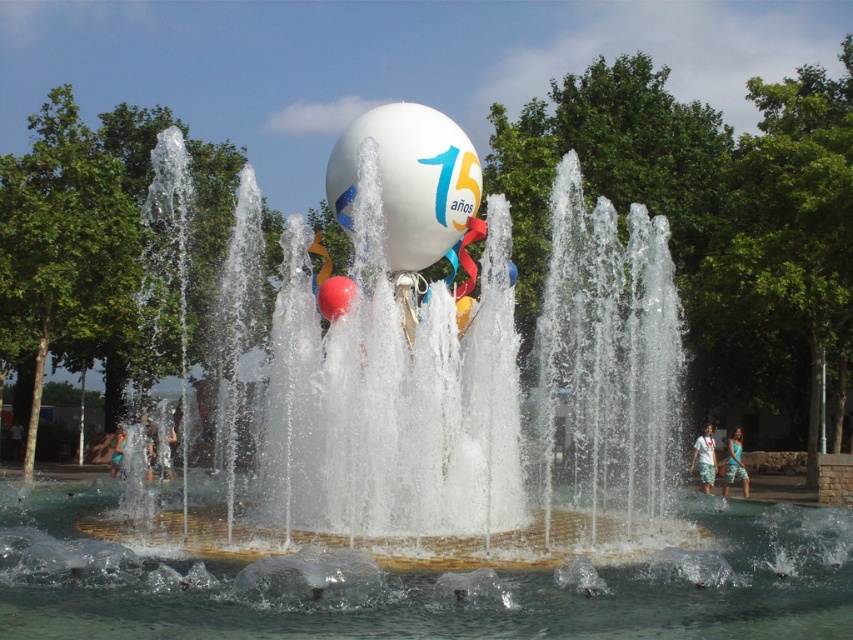
Which is above, clear water at center or white cotton shirt at lower right?

clear water at center is higher up.

Is point (685, 513) more distant than point (711, 456)?

No, (685, 513) is closer to viewer.

Locate an element on the screen. clear water at center is located at coordinates (430, 586).

Looking at this image, who is higher up, clear water at center or rubber balloon at center?

rubber balloon at center is higher up.

Is clear water at center further to camera compared to rubber balloon at center?

No, it is not.

Does point (115, 602) come closer to viewer compared to point (318, 304)?

That is True.

At what (x,y) coordinates should I click in order to perform the action: click on clear water at center. Please return your answer as a coordinate pair (x, y). The height and width of the screenshot is (640, 853). Looking at the image, I should click on (430, 586).

Based on the photo, is white glossy balloon at center positioned in front of white cotton shirt at lower right?

Yes, white glossy balloon at center is closer to the viewer.

Does white glossy balloon at center appear under white cotton shirt at lower right?

No.

Locate an element on the screen. Image resolution: width=853 pixels, height=640 pixels. white glossy balloon at center is located at coordinates (409, 180).